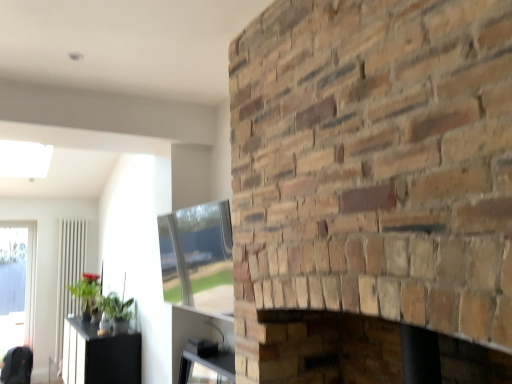
This screenshot has height=384, width=512. What do you see at coordinates (369, 184) in the screenshot? I see `natural stone fireplace at center` at bounding box center [369, 184].

Where is `black glossy table at lower left`? Image resolution: width=512 pixels, height=384 pixels. black glossy table at lower left is located at coordinates (99, 355).

Describe the element at coordinates (99, 355) in the screenshot. Image resolution: width=512 pixels, height=384 pixels. I see `black glossy table at lower left` at that location.

Where is `transparent glass door at left`? The image size is (512, 384). transparent glass door at left is located at coordinates (17, 284).

You are a GUI agent. You are given a task and a screenshot of the screen. Output one action in this format:
    pyautogui.click(x=<x>, y=<y>)
    Task: Click on the green leafy plant at lower left, the first plant when ordered from front to back
    The width and height of the screenshot is (512, 384).
    Given the screenshot: What is the action you would take?
    (115, 307)

Does green leafy plant at lower left, the first plant when ordered from front to back, turn towards natural stone fireplace at center?

No, green leafy plant at lower left, the first plant when ordered from front to back, does not turn towards natural stone fireplace at center.

From the image's perspective, which is above, green leafy plant at lower left, the first plant when ordered from front to back, or natural stone fireplace at center?

natural stone fireplace at center appears higher in the image.

From the image's perspective, would you say white glossy radiator at left is shown under black glossy table at lower left?

No.

Who is shorter, white glossy radiator at left or black glossy table at lower left?

With less height is black glossy table at lower left.

Considering the relative sizes of white glossy radiator at left and black glossy table at lower left in the image provided, is white glossy radiator at left thinner than black glossy table at lower left?

Yes.

Is white glossy radiator at left not near black glossy table at lower left?

Indeed, white glossy radiator at left is not near black glossy table at lower left.

From the image's perspective, is transparent glass door at left located above natural stone fireplace at center?

No, from the image's perspective, transparent glass door at left is not over natural stone fireplace at center.

In terms of width, does transparent glass door at left look wider or thinner when compared to natural stone fireplace at center?

transparent glass door at left is thinner than natural stone fireplace at center.

Is transparent glass door at left not close to natural stone fireplace at center?

That's right, there is a large distance between transparent glass door at left and natural stone fireplace at center.

Measure the distance from transparent glass door at left to natural stone fireplace at center.

transparent glass door at left and natural stone fireplace at center are 5.84 meters apart from each other.

Relative to transparent glass door at left, is green matte plant at left, the first plant positioned from the back, in front or behind?

green matte plant at left, the first plant positioned from the back, is in front of transparent glass door at left.

Could you tell me if green matte plant at left, the 1th plant from the left, is facing transparent glass door at left?

No, green matte plant at left, the 1th plant from the left, is not turned towards transparent glass door at left.

Is point (96, 283) positioned before point (7, 265)?

That is True.

Considering the sizes of objects green matte plant at left, the 1th plant from the left, and transparent glass door at left in the image provided, who is thinner, green matte plant at left, the 1th plant from the left, or transparent glass door at left?

transparent glass door at left is thinner.

Based on the photo, is dark gray fabric swivel chair at lower left spatially inside black glossy table at lower left, or outside of it?

dark gray fabric swivel chair at lower left is outside black glossy table at lower left.

Which object is thinner, dark gray fabric swivel chair at lower left or black glossy table at lower left?

Thinner between the two is dark gray fabric swivel chair at lower left.

From the image's perspective, is dark gray fabric swivel chair at lower left located beneath black glossy table at lower left?

Yes, from the image's perspective, dark gray fabric swivel chair at lower left is beneath black glossy table at lower left.

What are the coordinates of `table in front of the transparent glass door at left` in the screenshot? It's located at (99, 355).

From the image's perspective, which is above, black glossy table at lower left or transparent glass door at left?

transparent glass door at left, from the image's perspective.

Are black glossy table at lower left and transparent glass door at left making contact?

No, black glossy table at lower left is not making contact with transparent glass door at left.

Identify the location of screen door below the natural stone fireplace at center (from the image's perspective). The image size is (512, 384). (69, 274).

Does point (61, 263) appear closer or farther from the camera than point (344, 60)?

Point (61, 263) is farther from the camera than point (344, 60).

Is white glossy radiator at left inside or outside of natural stone fireplace at center?

white glossy radiator at left cannot be found inside natural stone fireplace at center.

Between white glossy radiator at left and natural stone fireplace at center, which one has more height?

With more height is white glossy radiator at left.

There is a natural stone fireplace at center. At what (x,y) coordinates should I click in order to perform the action: click on the 2nd plant below it (from a real-world perspective). Please return your answer as a coordinate pair (x, y). The width and height of the screenshot is (512, 384). Looking at the image, I should click on (115, 307).

Find the location of a particular element. screen door above the black glossy table at lower left (from the image's perspective) is located at coordinates (69, 274).

Estimate the real-world distances between objects in this image. Which object is closer to white glossy radiator at left, green leafy plant at lower left, the second plant in the back-to-front sequence, or natural stone fireplace at center?

Among the two, green leafy plant at lower left, the second plant in the back-to-front sequence, is located nearer to white glossy radiator at left.

Looking at this image, from the image, which object appears to be nearer to green matte plant at left, the first plant positioned from the back, natural stone fireplace at center or white glossy radiator at left?

white glossy radiator at left lies closer to green matte plant at left, the first plant positioned from the back, than the other object.

From the picture: Estimate the real-world distances between objects in this image. Which object is further from black glossy table at lower left, white glossy radiator at left or green matte plant at left, the 2th plant viewed from the right?

white glossy radiator at left lies further to black glossy table at lower left than the other object.

Looking at the image, which one is located further to transparent glass door at left, white glossy radiator at left or black glossy table at lower left?

The object further to transparent glass door at left is black glossy table at lower left.

Looking at the image, which one is located closer to black glossy table at lower left, white glossy radiator at left or green leafy plant at lower left, acting as the 1th plant starting from the right?

green leafy plant at lower left, acting as the 1th plant starting from the right, is closer to black glossy table at lower left.

From the image, which object appears to be nearer to transparent glass door at left, dark gray fabric swivel chair at lower left or white glossy radiator at left?

Based on the image, white glossy radiator at left appears to be nearer to transparent glass door at left.

When comparing their distances from natural stone fireplace at center, does green matte plant at left, the 1th plant from the left, or dark gray fabric swivel chair at lower left seem further?

→ dark gray fabric swivel chair at lower left lies further to natural stone fireplace at center than the other object.

Considering their positions, is natural stone fireplace at center positioned further to dark gray fabric swivel chair at lower left than green matte plant at left, the first plant positioned from the back?

natural stone fireplace at center lies further to dark gray fabric swivel chair at lower left than the other object.

Where is `window that lies between white glossy radiator at left and dark gray fabric swivel chair at lower left from top to bottom`? The image size is (512, 384). window that lies between white glossy radiator at left and dark gray fabric swivel chair at lower left from top to bottom is located at coordinates (17, 284).

The image size is (512, 384). I want to click on swivel chair between transparent glass door at left and green leafy plant at lower left, the first plant when ordered from front to back, so click(x=17, y=366).

Locate an element on the screen. Image resolution: width=512 pixels, height=384 pixels. swivel chair between natural stone fireplace at center and transparent glass door at left from front to back is located at coordinates (17, 366).

The width and height of the screenshot is (512, 384). I want to click on swivel chair located between black glossy table at lower left and transparent glass door at left in the depth direction, so click(x=17, y=366).